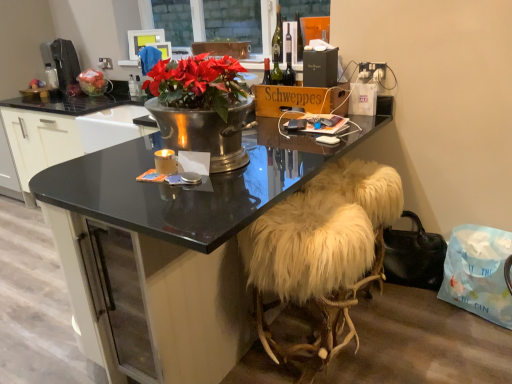
What is the approximate width of matte plastic television at upper center?

matte plastic television at upper center is 3.80 inches in width.

You are a GUI agent. You are given a task and a screenshot of the screen. Output one action in this format:
    pyautogui.click(x=<x>, y=<y>)
    Task: Click on the metallic silver sink at center
    This screenshot has height=384, width=512.
    Given the screenshot: What is the action you would take?
    pyautogui.click(x=111, y=127)

Describe the element at coordinates (111, 127) in the screenshot. I see `metallic silver sink at center` at that location.

In order to face clear glass window at upper center, should I rotate leftwards or rightwards?

You should rotate left by 4.380 degrees.

Identify the location of white plastic power outlet at upper center. The height and width of the screenshot is (384, 512). (105, 63).

Find the location of a particular element. matte plastic television at upper center is located at coordinates (143, 39).

From a real-world perspective, is white fur stool at lower right physically located above or below metallic silver sink at center?

From a real-world perspective, white fur stool at lower right is physically below metallic silver sink at center.

Is white fur stool at lower right facing away from metallic silver sink at center?

No, white fur stool at lower right is not facing the opposite direction of metallic silver sink at center.

Considering the sizes of objects white fur stool at lower right and metallic silver sink at center in the image provided, who is wider, white fur stool at lower right or metallic silver sink at center?

white fur stool at lower right is wider.

Can metallic silver sink at center be found inside white fur stool at lower right?

No, white fur stool at lower right does not contain metallic silver sink at center.

Can you confirm if clear glass window at upper center is wider than matte plastic television at upper center?

Yes.

Is matte plastic television at upper center at the back of clear glass window at upper center?

Yes, matte plastic television at upper center is at the back of clear glass window at upper center.

Consider the image. What's the angular difference between clear glass window at upper center and matte plastic television at upper center's facing directions?

The angular difference between clear glass window at upper center and matte plastic television at upper center is 38.2 degrees.

At what (x,y) coordinates should I click in order to perform the action: click on television below the clear glass window at upper center (from the image's perspective). Please return your answer as a coordinate pair (x, y). The image size is (512, 384). Looking at the image, I should click on (143, 39).

Is clear glass window at upper center not inside metallic silver sink at center?

Yes, clear glass window at upper center is outside of metallic silver sink at center.

Considering the relative positions of clear glass window at upper center and metallic silver sink at center in the image provided, is clear glass window at upper center to the left or to the right of metallic silver sink at center?

clear glass window at upper center is positioned on metallic silver sink at center's right side.

Is clear glass window at upper center shorter than metallic silver sink at center?

No.

Is clear glass window at upper center facing away from metallic silver sink at center?

No, metallic silver sink at center is not at the back of clear glass window at upper center.

Which object is further away from the camera taking this photo, matte black bottle at upper center or white fur stool at lower right?

matte black bottle at upper center is behind.

Which is closer, [137,86] or [391,187]?

Positioned in front is point [391,187].

From a real-world perspective, is matte black bottle at upper center above or below white fur stool at lower right?

matte black bottle at upper center is above white fur stool at lower right.

Would you say matte black bottle at upper center is inside or outside white matte mouse at upper right?

matte black bottle at upper center is outside white matte mouse at upper right.

Which object is positioned more to the right, matte black bottle at upper center or white matte mouse at upper right?

From the viewer's perspective, white matte mouse at upper right appears more on the right side.

Relative to white matte mouse at upper right, is matte black bottle at upper center in front or behind?

Visually, matte black bottle at upper center is located behind white matte mouse at upper right.

Is there a large distance between white plastic power outlet at upper center and white matte mouse at upper right?

Yes.

Considering the positions of point (108, 60) and point (326, 139), is point (108, 60) closer or farther from the camera than point (326, 139)?

Point (108, 60) appears to be farther away from the viewer than point (326, 139).

You are a GUI agent. You are given a task and a screenshot of the screen. Output one action in this format:
    pyautogui.click(x=<x>, y=<y>)
    Task: Click on the power outlet behind the white matte mouse at upper right
    This screenshot has width=512, height=384.
    Given the screenshot: What is the action you would take?
    pyautogui.click(x=105, y=63)

From the image's perspective, is white plastic power outlet at upper center beneath white matte mouse at upper right?

Actually, white plastic power outlet at upper center appears above white matte mouse at upper right in the image.

From the image's perspective, is matte plastic television at upper center beneath metallic silver sink at center?

No, from the image's perspective, matte plastic television at upper center is not below metallic silver sink at center.

Looking at this image, from a real-world perspective, is matte plastic television at upper center located higher than metallic silver sink at center?

Yes, from a real-world perspective, matte plastic television at upper center is on top of metallic silver sink at center.

Is matte plastic television at upper center at the left side of metallic silver sink at center?

Incorrect, matte plastic television at upper center is not on the left side of metallic silver sink at center.

The image size is (512, 384). I want to click on sink in front of the matte plastic television at upper center, so click(111, 127).

The image size is (512, 384). Identify the location of stool in front of the metallic silver sink at center. (322, 251).

Locate an element on the screen. television behind the clear glass window at upper center is located at coordinates (143, 39).

When comparing their distances from clear glass window at upper center, does white fur stool at lower right or white plastic power outlet at upper center seem further?

white fur stool at lower right.

Consider the image. Which object lies further to the anchor point black leather handbag at lower right, white plastic power outlet at upper center or metallic silver sink at center?

white plastic power outlet at upper center.

From the image, which object appears to be nearer to matte plastic bag of red apples at left, matte plastic television at upper center or white fur stool at lower right?

matte plastic television at upper center.

Considering their positions, is metallic silver sink at center positioned further to black plastic coffee machine at left than matte black bottle at upper center?

metallic silver sink at center is further to black plastic coffee machine at left.

Based on the photo, when comparing their distances from matte black bottle at upper center, does clear glass window at upper center or black glossy desk at center seem further?

black glossy desk at center lies further to matte black bottle at upper center than the other object.

Looking at this image, from the image, which object appears to be nearer to metallic silver sink at center, matte plastic television at upper center or matte plastic bag of red apples at left?

Based on the image, matte plastic television at upper center appears to be nearer to metallic silver sink at center.

When comparing their distances from matte plastic television at upper center, does matte black bottle at upper center or black glossy desk at center seem closer?

The object closer to matte plastic television at upper center is matte black bottle at upper center.

Estimate the real-world distances between objects in this image. Which object is closer to white fur stool at lower right, white plastic power outlet at upper center or black leather handbag at lower right?

black leather handbag at lower right is positioned closer to the anchor white fur stool at lower right.

Where is `stool located between matte plastic bag of red apples at left and black leather handbag at lower right in the left-right direction`? This screenshot has height=384, width=512. stool located between matte plastic bag of red apples at left and black leather handbag at lower right in the left-right direction is located at coordinates (322, 251).

Locate an element on the screen. The width and height of the screenshot is (512, 384). bottle between black glossy desk at center and black plastic coffee machine at left in the front-back direction is located at coordinates (134, 85).

I want to click on window screen between black glossy desk at center and matte black bottle at upper center along the z-axis, so click(x=234, y=21).

The width and height of the screenshot is (512, 384). I want to click on desk between clear glass window at upper center and black leather handbag at lower right in the up-down direction, so click(x=174, y=246).